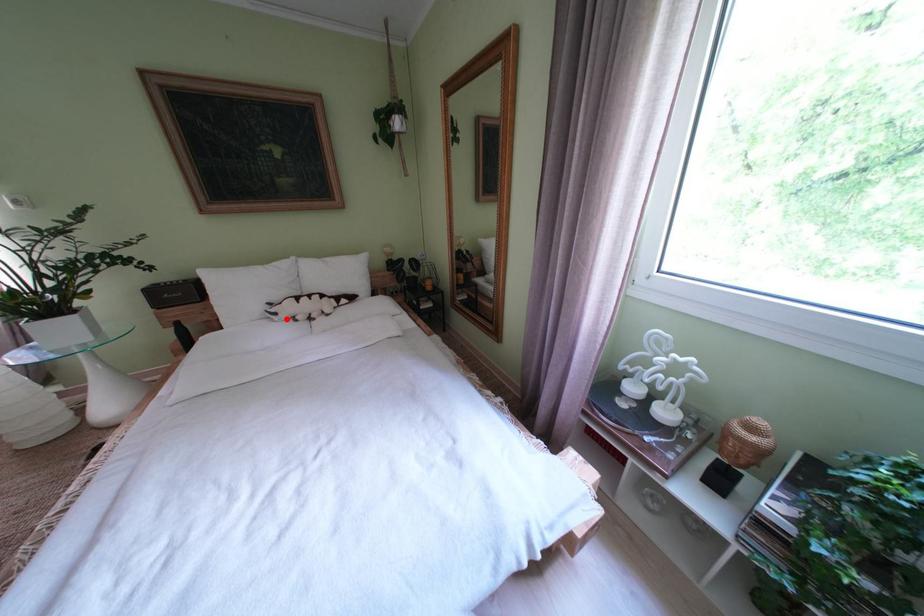
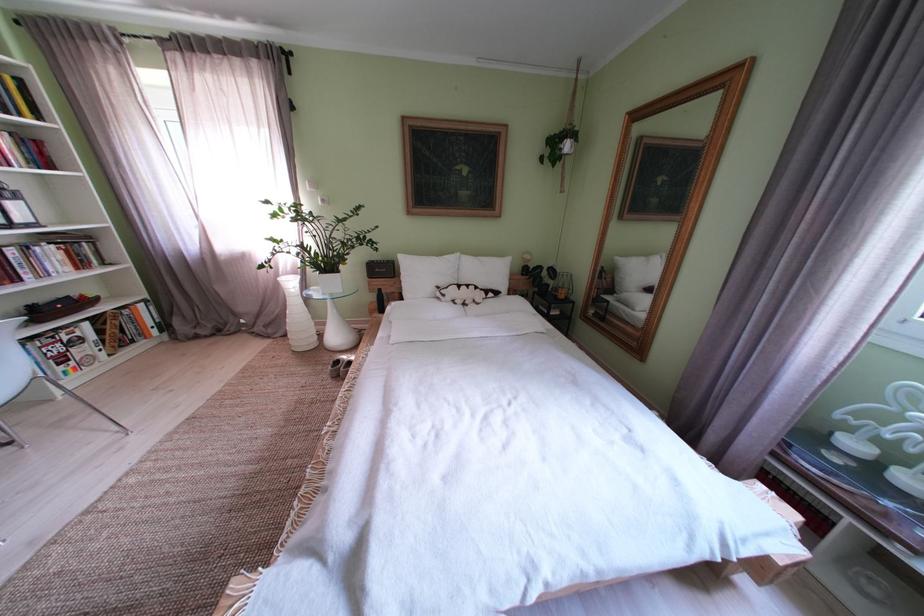
Locate, in the second image, the point that corresponds to the highlighted location in the first image.

(455, 301)